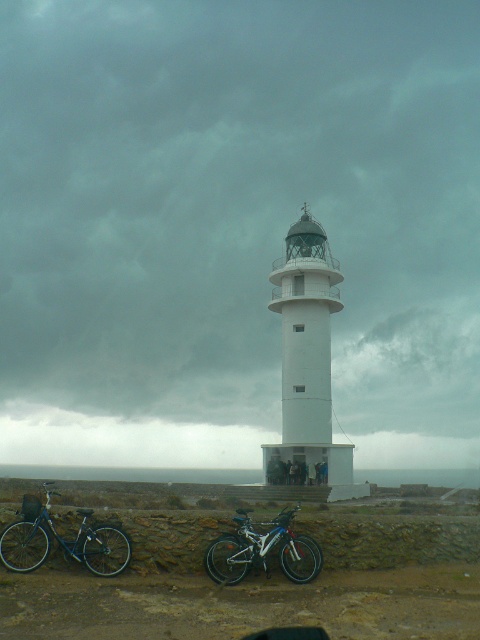
Who is taller, white matte lighthouse at center or dark gray stone couple at center?

white matte lighthouse at center is taller.

In the scene shown: Can you confirm if white matte lighthouse at center is shorter than dark gray stone couple at center?

No, white matte lighthouse at center is not shorter than dark gray stone couple at center.

The height and width of the screenshot is (640, 480). I want to click on white matte lighthouse at center, so click(x=235, y=225).

Locate an element on the screen. This screenshot has height=640, width=480. white matte lighthouse at center is located at coordinates (235, 225).

Can you confirm if white matte lighthouse at center is taller than shiny black bicycle at lower left?

Yes.

Can you confirm if white matte lighthouse at center is wider than shiny black bicycle at lower left?

Correct, the width of white matte lighthouse at center exceeds that of shiny black bicycle at lower left.

This screenshot has width=480, height=640. What do you see at coordinates (235, 225) in the screenshot? I see `white matte lighthouse at center` at bounding box center [235, 225].

Where is `white matte lighthouse at center`? Image resolution: width=480 pixels, height=640 pixels. white matte lighthouse at center is located at coordinates (235, 225).

Who is more forward, (436, 630) or (312, 577)?

Point (436, 630) is more forward.

Who is more forward, (x=160, y=624) or (x=217, y=573)?

Point (x=160, y=624) is in front.

Find the location of a particular element. metallic bicycles at lower center is located at coordinates (257, 580).